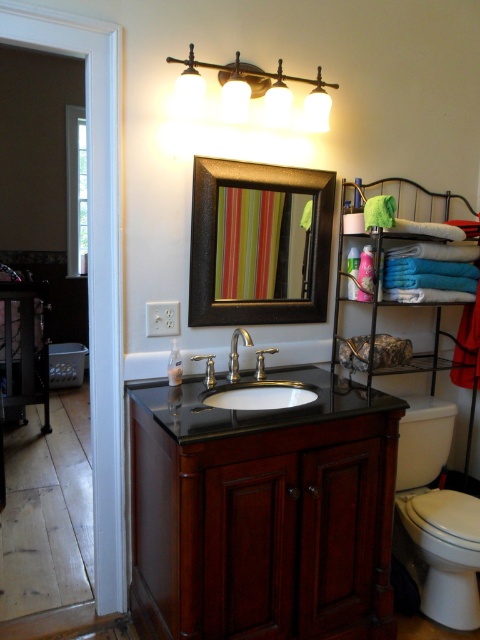
Which is more to the right, black polished granite sink at center or polished chrome faucet at center?

black polished granite sink at center

Is the position of black polished granite sink at center less distant than that of polished chrome faucet at center?

No, it is not.

Is point (286, 404) positioned behind point (232, 355)?

That is True.

In order to click on black polished granite sink at center in this screenshot , I will do `click(253, 385)`.

Is white glossy toilet bowl at lower right positioned in front of polished chrome faucet at center?

No.

Describe the element at coordinates (436, 520) in the screenshot. I see `white glossy toilet bowl at lower right` at that location.

Between point (452, 584) and point (229, 369), which one is positioned behind?

The point (229, 369) is more distant.

Find the location of a particular element. white glossy toilet bowl at lower right is located at coordinates (436, 520).

In the scene shown: Can you confirm if dark wood vanity at center is positioned above polished chrome faucet at center?

No, dark wood vanity at center is not above polished chrome faucet at center.

Does point (204, 557) come in front of point (236, 372)?

That is True.

Consider the image. Measure the distance between dark wood vanity at center and camera.

dark wood vanity at center is 4.92 feet away from camera.

I want to click on dark wood vanity at center, so click(263, 513).